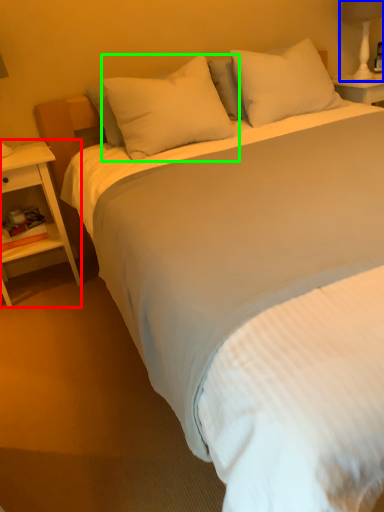
Question: Which object is positioned farthest from nightstand (highlighted by a red box)? Select from bedside lamp (highlighted by a blue box) and pillow (highlighted by a green box).

Choices:
 (A) bedside lamp
 (B) pillow

Answer: (A)